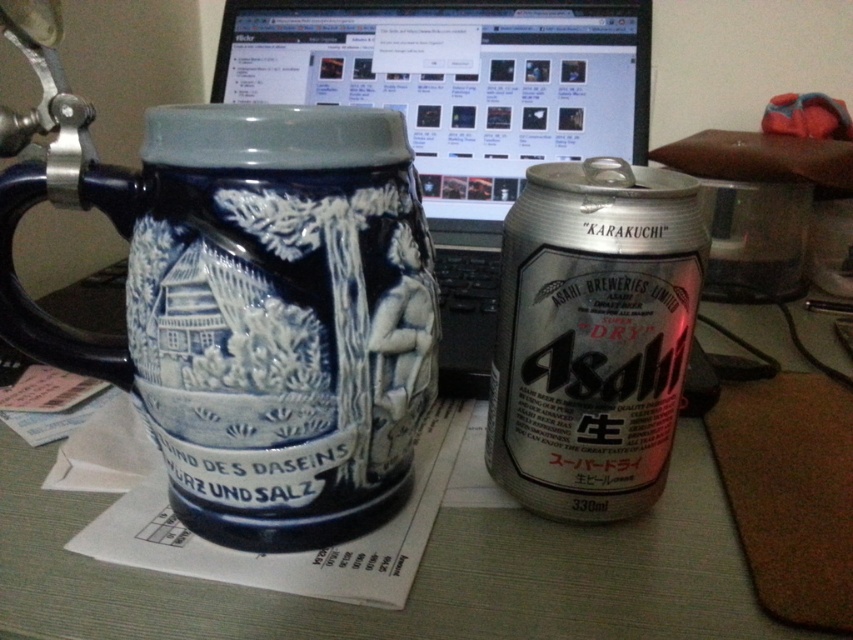
Question: Which point appears farthest from the camera in this image?

Choices:
 (A) coord(155,584)
 (B) coord(572,392)
 (C) coord(183,314)

Answer: (B)

Question: Can you confirm if blue ceramic mug at left is positioned below silver metallic beer can at center?

Choices:
 (A) no
 (B) yes

Answer: (B)

Question: Estimate the real-world distances between objects in this image. Which object is farther from the matte ceramic mug at center?

Choices:
 (A) blue ceramic mug at left
 (B) silver metallic beer can at center

Answer: (B)

Question: Does blue ceramic mug at left appear on the right side of matte ceramic mug at center?

Choices:
 (A) no
 (B) yes

Answer: (A)

Question: Which of the following is the farthest from the observer?

Choices:
 (A) (563, 262)
 (B) (207, 378)

Answer: (A)

Question: Does matte ceramic mug at center appear on the left side of silver metallic beer can at center?

Choices:
 (A) no
 (B) yes

Answer: (B)